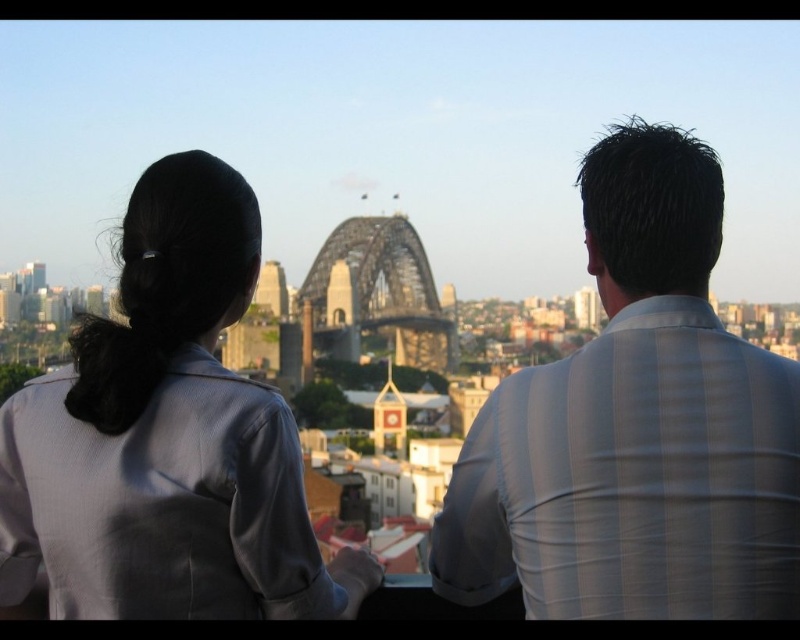
Question: Estimate the real-world distances between objects in this image. Which object is closer to the metallic bridge at center?

Choices:
 (A) white striped shirt at upper right
 (B) matte gray blazer at left

Answer: (A)

Question: Estimate the real-world distances between objects in this image. Which object is closer to the metallic bridge at center?

Choices:
 (A) white striped shirt at upper right
 (B) matte gray blazer at left

Answer: (A)

Question: Does white striped shirt at upper right have a smaller size compared to matte gray blazer at left?

Choices:
 (A) yes
 (B) no

Answer: (A)

Question: Does white striped shirt at upper right appear under metallic bridge at center?

Choices:
 (A) yes
 (B) no

Answer: (A)

Question: Which point is farther to the camera?

Choices:
 (A) metallic bridge at center
 (B) matte gray blazer at left

Answer: (A)

Question: Does matte gray blazer at left have a greater width compared to metallic bridge at center?

Choices:
 (A) yes
 (B) no

Answer: (A)